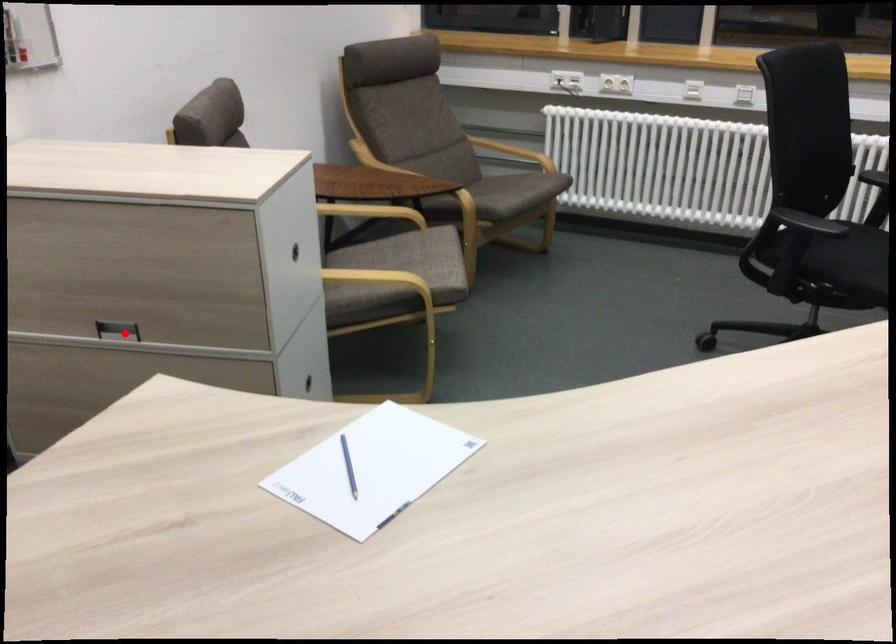
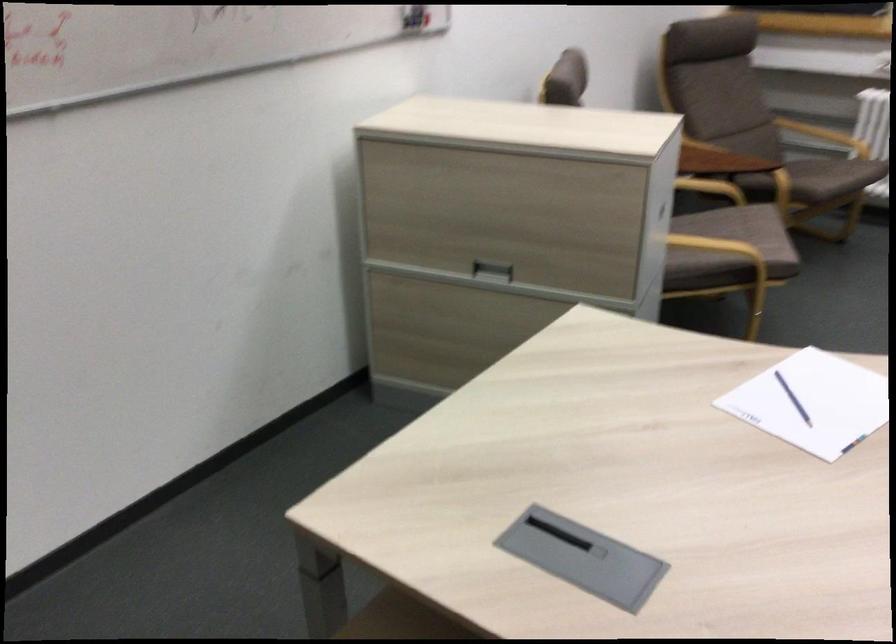
Question: I am providing you with two images of the same scene from different viewpoints. A red point is marked on the first image. Is the red point's position out of view in image 2?

Choices:
 (A) Yes
 (B) No

Answer: (B)